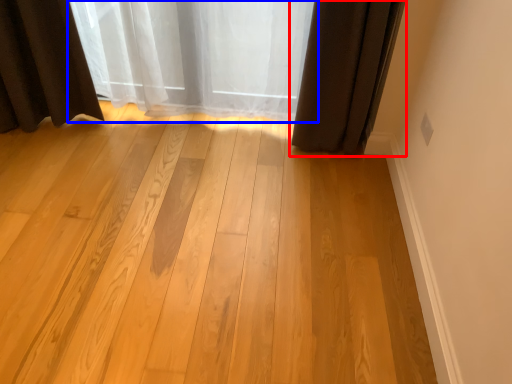
Question: Which point is further to the camera, curtain (highlighted by a red box) or curtain (highlighted by a blue box)?

Choices:
 (A) curtain
 (B) curtain

Answer: (B)